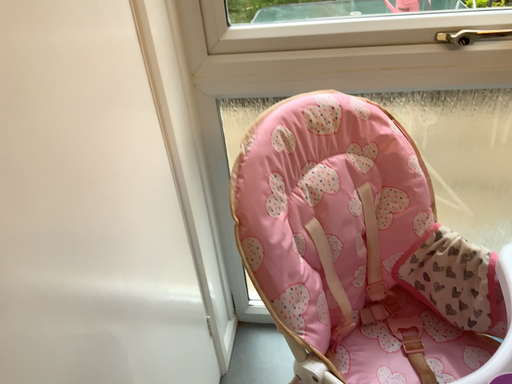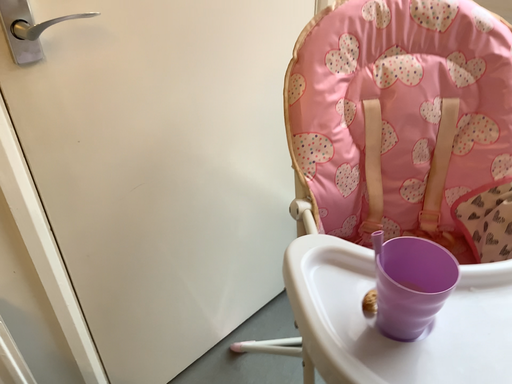
Question: Which way did the camera rotate in the video?

Choices:
 (A) rotated left
 (B) rotated right

Answer: (A)